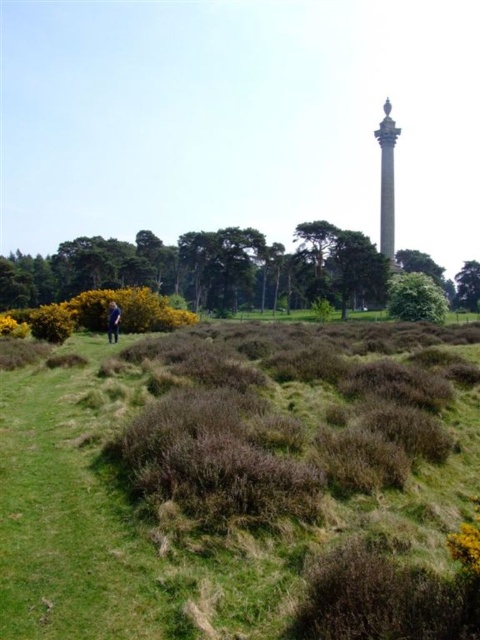
You are an architect designing a new garden layout and want to place a statue where the smooth gray column at upper right and the green leafy tree at upper right are visible. Based on their positions, which object would you need to consider first to ensure both are in view?

The smooth gray column at upper right is located above the green leafy tree at upper right, so you should first ensure the statue is placed where the lower green leafy tree at upper right is visible, as the column above it will naturally be in view as well.

You are a gardener planning to mow the green grass at center and trim the green leafy tree at lower left. Which task requires more time considering their widths?

The green leafy tree at lower left requires more time since it has a greater width than the green grass at center.